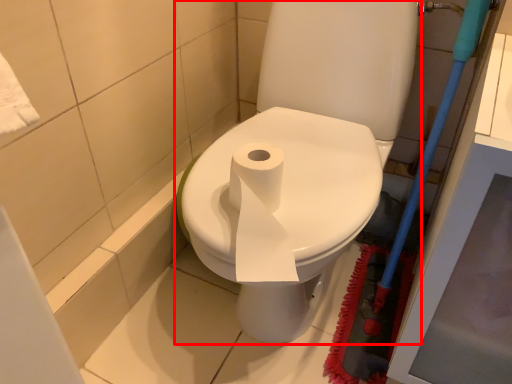
Question: Observing the image, what is the correct spatial positioning of toilet (annotated by the red box) in reference to brush?

Choices:
 (A) right
 (B) left

Answer: (B)